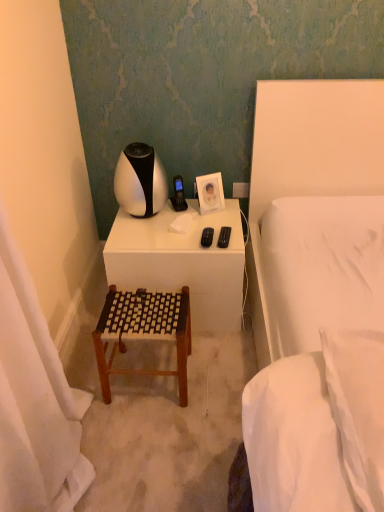
Question: Does white fabric curtain at left appear on the right side of white fabric bed at right?

Choices:
 (A) no
 (B) yes

Answer: (A)

Question: Is white fabric curtain at left not close to white fabric bed at right?

Choices:
 (A) no
 (B) yes

Answer: (B)

Question: From the image's perspective, is white fabric curtain at left on white fabric bed at right?

Choices:
 (A) yes
 (B) no

Answer: (B)

Question: Can you confirm if white fabric curtain at left is taller than white fabric bed at right?

Choices:
 (A) no
 (B) yes

Answer: (A)

Question: Does white fabric curtain at left have a larger size compared to white fabric bed at right?

Choices:
 (A) yes
 (B) no

Answer: (B)

Question: Is white fabric curtain at left behind white fabric bed at right?

Choices:
 (A) no
 (B) yes

Answer: (B)

Question: Is white fabric bed at right a part of white glossy table lamp at upper center?

Choices:
 (A) no
 (B) yes

Answer: (A)

Question: Considering the relative positions of white glossy table lamp at upper center and white fabric bed at right in the image provided, is white glossy table lamp at upper center behind white fabric bed at right?

Choices:
 (A) no
 (B) yes

Answer: (B)

Question: From a real-world perspective, is white glossy table lamp at upper center under white fabric bed at right?

Choices:
 (A) no
 (B) yes

Answer: (A)

Question: Does white glossy table lamp at upper center turn towards white fabric bed at right?

Choices:
 (A) yes
 (B) no

Answer: (B)

Question: From a real-world perspective, is white glossy table lamp at upper center over white fabric bed at right?

Choices:
 (A) no
 (B) yes

Answer: (B)

Question: Considering the relative positions of white glossy table lamp at upper center and white fabric bed at right in the image provided, is white glossy table lamp at upper center to the right of white fabric bed at right from the viewer's perspective?

Choices:
 (A) yes
 (B) no

Answer: (B)

Question: Is white fabric curtain at left completely or partially outside of white soft pillow at right?

Choices:
 (A) yes
 (B) no

Answer: (A)